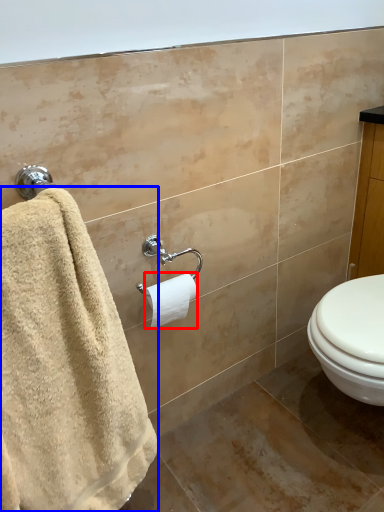
Question: Which object is further to the camera taking this photo, toilet paper (highlighted by a red box) or towel (highlighted by a blue box)?

Choices:
 (A) toilet paper
 (B) towel

Answer: (A)